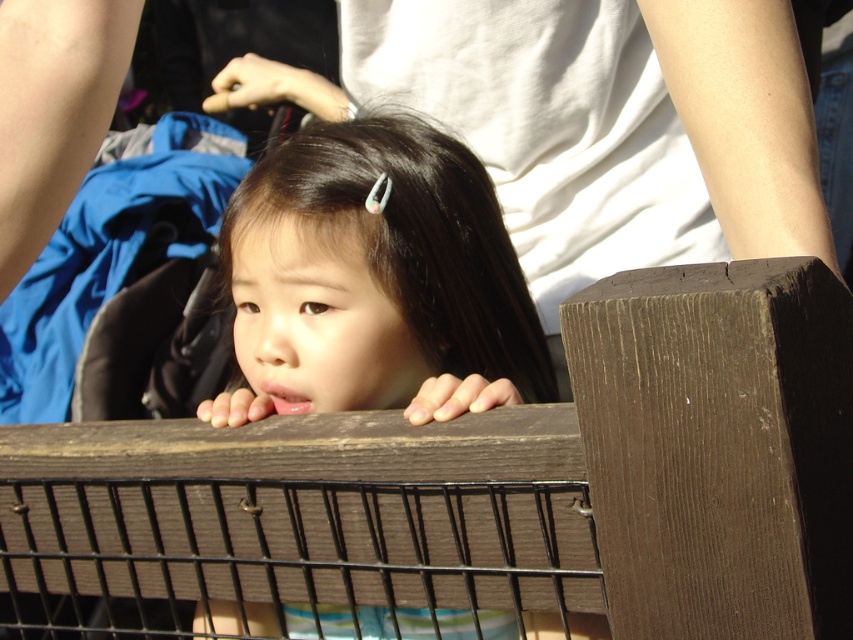
Question: Which point is closer to the camera?

Choices:
 (A) (186, 579)
 (B) (289, 224)

Answer: (A)

Question: In this image, where is brown wooden fence at center located relative to smooth brown hair at center?

Choices:
 (A) right
 (B) left

Answer: (B)

Question: Which object appears farthest from the camera in this image?

Choices:
 (A) smooth brown hair at center
 (B) brown wooden fence at center

Answer: (A)

Question: Does brown wooden fence at center have a lesser width compared to smooth brown hair at center?

Choices:
 (A) yes
 (B) no

Answer: (B)

Question: Which object is closer to the camera taking this photo?

Choices:
 (A) smooth brown hair at center
 (B) brown wooden fence at center

Answer: (B)

Question: Observing the image, what is the correct spatial positioning of brown wooden fence at center in reference to smooth brown hair at center?

Choices:
 (A) right
 (B) left

Answer: (B)